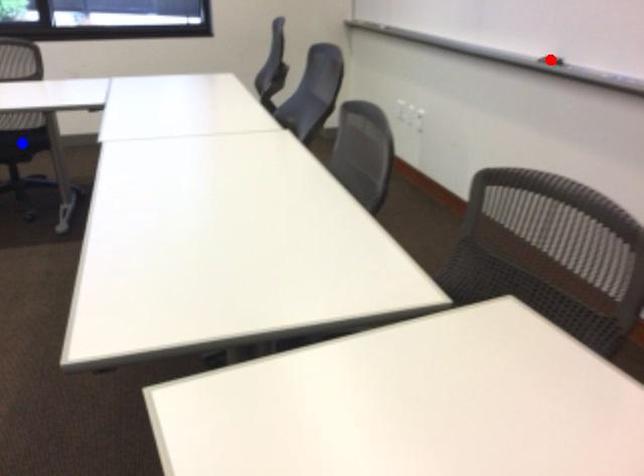
Question: Which of the two points in the image is closer to the camera?

Choices:
 (A) Blue point is closer.
 (B) Red point is closer.

Answer: (B)